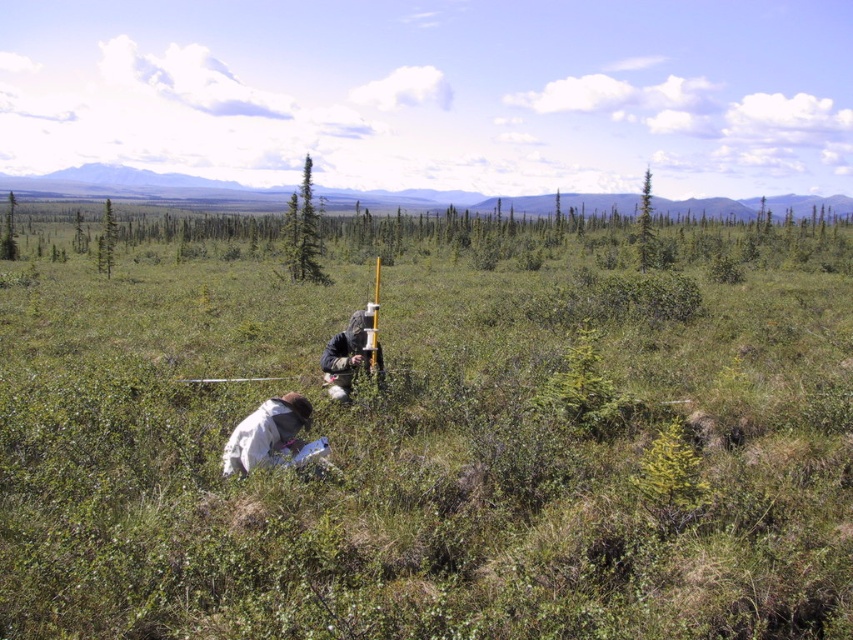
Does green textured tree at upper right have a lesser height compared to green coniferous tree at upper left?

No.

Does point (645, 182) come behind point (106, 275)?

That is True.

Between point (639, 211) and point (113, 234), which one is positioned in front?

Positioned in front is point (113, 234).

In order to click on green textured tree at upper right in this screenshot , I will do `click(645, 225)`.

Can you confirm if white fabric at lower left is taller than green coniferous tree at upper left?

In fact, white fabric at lower left may be shorter than green coniferous tree at upper left.

Does point (270, 438) lie in front of point (107, 257)?

Yes, it is in front of point (107, 257).

Between point (260, 419) and point (108, 250), which one is positioned in front?

Point (260, 419)

Find the location of a particular element. This screenshot has height=640, width=853. white fabric at lower left is located at coordinates coord(273,436).

Is point (309, 280) less distant than point (651, 252)?

Yes, point (309, 280) is in front of point (651, 252).

Based on the photo, who is higher up, green matte tree at center or green textured tree at upper right?

green textured tree at upper right is higher up.

Who is more forward, (x=316, y=269) or (x=640, y=202)?

Point (x=316, y=269) is in front.

Identify the location of green matte tree at center. This screenshot has width=853, height=640. (302, 234).